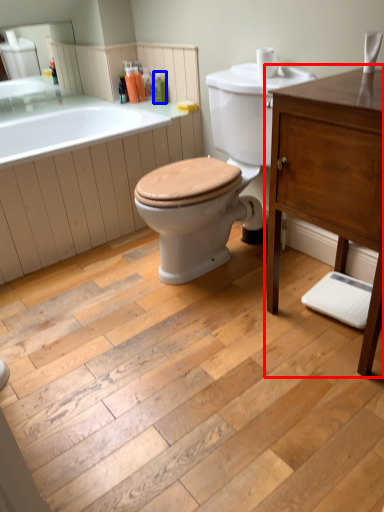
Question: Which object appears closest to the camera in this image, bathroom cabinet (highlighted by a red box) or toiletry (highlighted by a blue box)?

Choices:
 (A) bathroom cabinet
 (B) toiletry

Answer: (A)